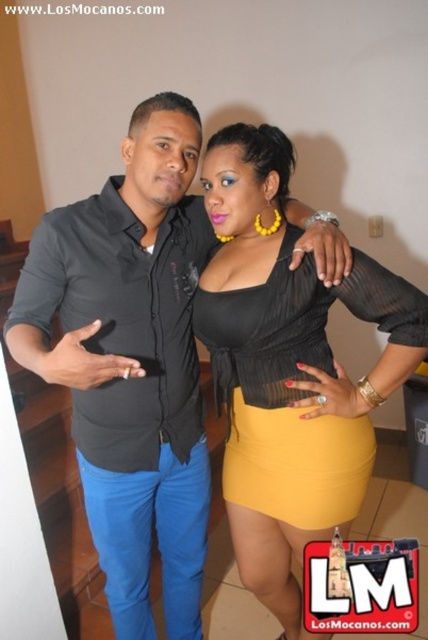
You are an interior designer assessing the layout of a small apartment. You notice two central items in the room, the black matte shirt at center and the matte black blouse at center. Which of these two items is taller?

The black matte shirt at center is taller than the matte black blouse at center.

You are a photographer setting up a shoot. You notice two items in the scene that are both centered but at different vertical positions. The items are the black matte shirt at center and the matte black blouse at center. Which one is positioned higher up?

The black matte shirt at center is located above the matte black blouse at center, so it is positioned higher up.

You are standing in the room and want to hand a gift to the person wearing the black matte shirt at center. Based on their positions, which direction should you move to approach them?

The black matte shirt at center is located at point (130, 360), so you should move towards the center of the room to reach them.